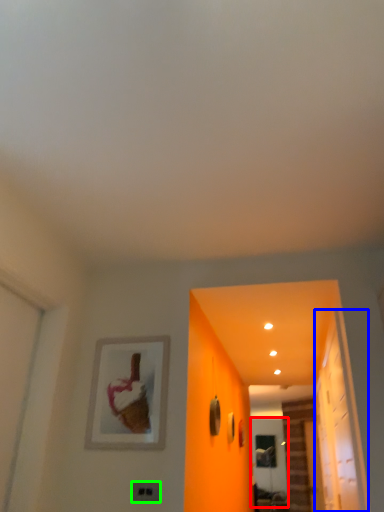
Question: Which object is the closest to the screen door (highlighted by a red box)? Choose among these: glass door (highlighted by a blue box) or electric outlet (highlighted by a green box).

Choices:
 (A) glass door
 (B) electric outlet

Answer: (A)